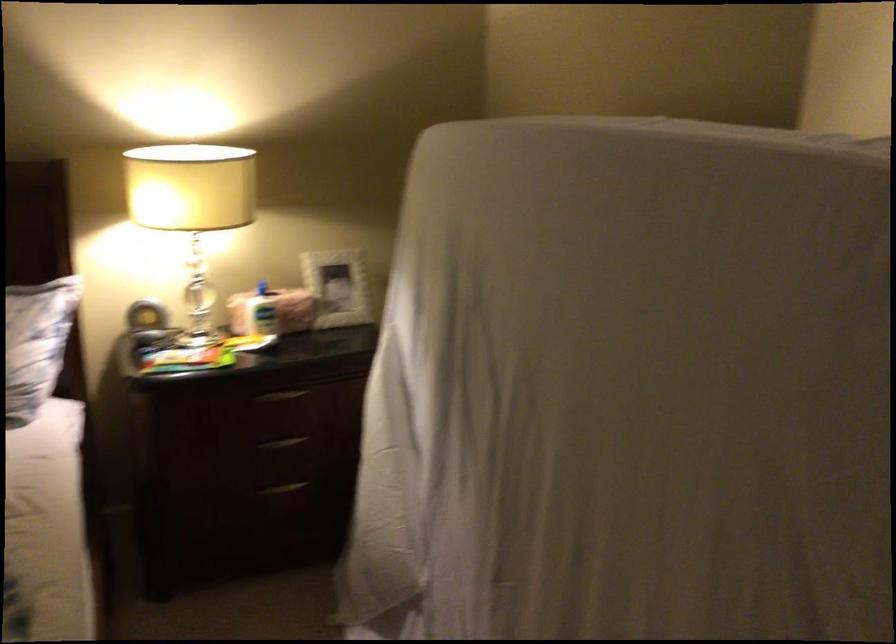
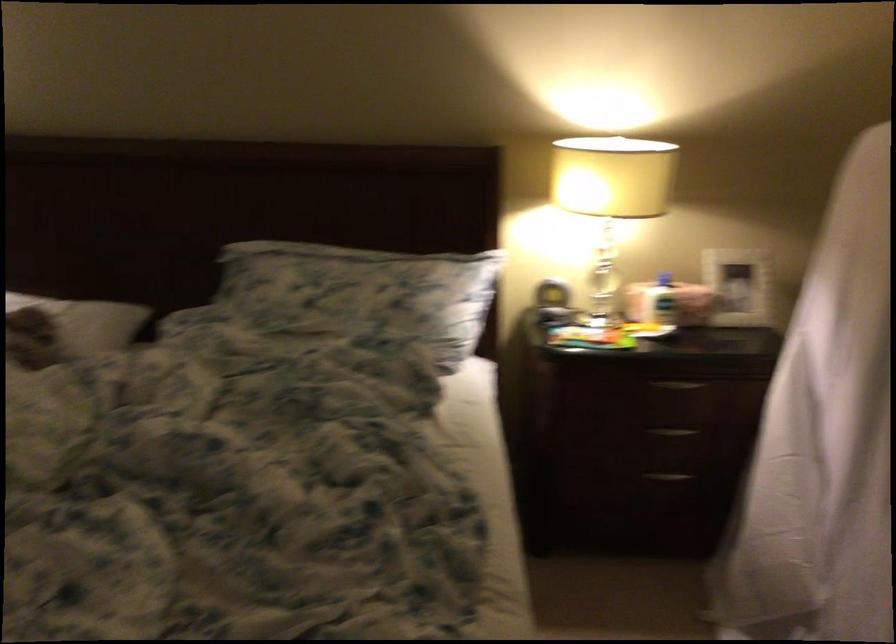
Where in the second image is the point corresponding to pixel 257 295 from the first image?

(664, 279)